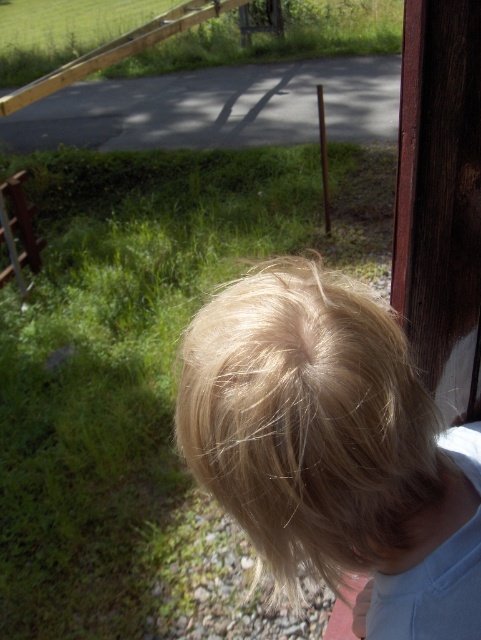
From the picture: Who is shorter, blonde hair at upper right or brushed metal fence at left?

Standing shorter between the two is blonde hair at upper right.

Does blonde hair at upper right have a lesser width compared to brushed metal fence at left?

Correct, blonde hair at upper right's width is less than brushed metal fence at left's.

Who is more forward, [331,378] or [29,224]?

Positioned in front is point [331,378].

Where is `blonde hair at upper right`? This screenshot has width=481, height=640. blonde hair at upper right is located at coordinates (316, 426).